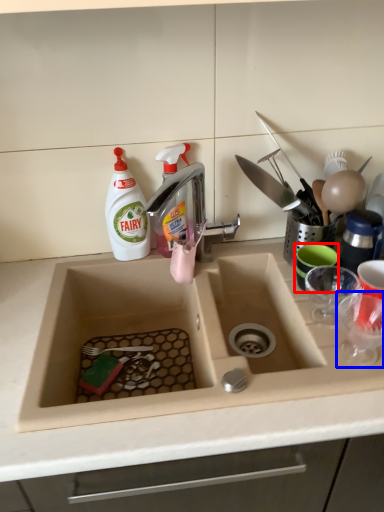
Question: Which of the following is the farthest to the observer, tableware (highlighted by a red box) or tableware (highlighted by a blue box)?

Choices:
 (A) tableware
 (B) tableware

Answer: (A)